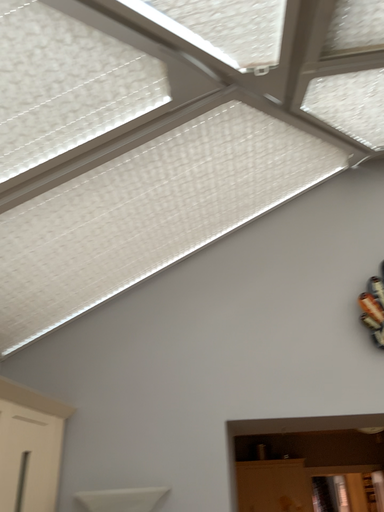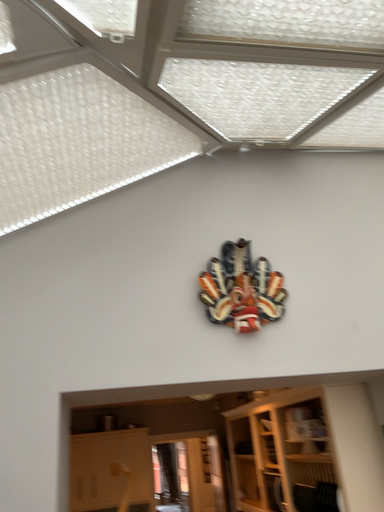
Question: How did the camera likely rotate when shooting the video?

Choices:
 (A) rotated right
 (B) rotated left

Answer: (A)